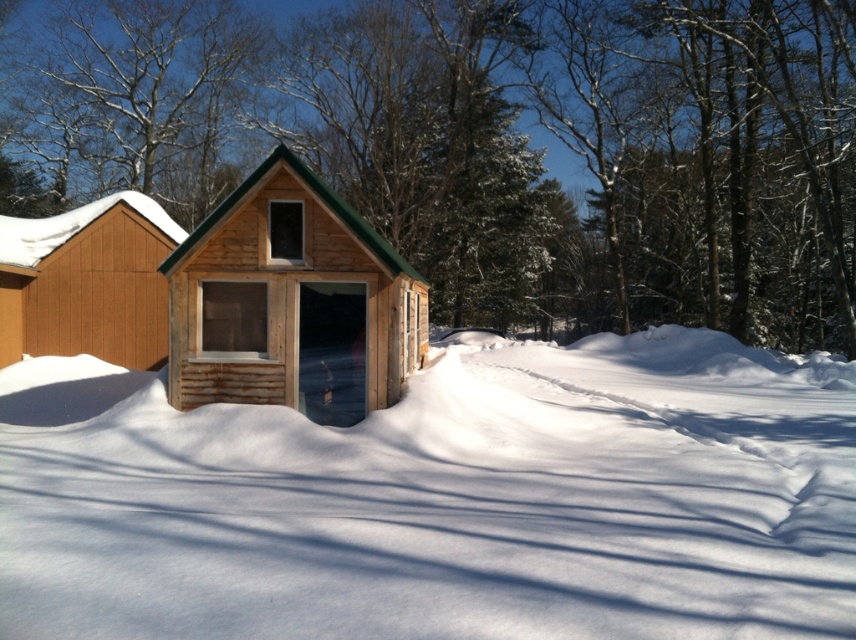
This screenshot has height=640, width=856. What do you see at coordinates (290, 300) in the screenshot?
I see `natural wood cabin at center` at bounding box center [290, 300].

Who is more distant from viewer, (394, 314) or (6, 225)?

The point (6, 225) is more distant.

Who is more distant from viewer, (343, 316) or (28, 252)?

The point (28, 252) is more distant.

Find the location of a particular element. This screenshot has height=640, width=856. natural wood cabin at center is located at coordinates (290, 300).

Which is above, natural wood cabin at center or bare branches at upper center?

bare branches at upper center

You are a GUI agent. You are given a task and a screenshot of the screen. Output one action in this format:
    pyautogui.click(x=<x>, y=<y>)
    Task: Click on the natural wood cabin at center
    
    Given the screenshot: What is the action you would take?
    [290, 300]

Does point (385, 388) lie in front of point (253, 48)?

Yes.

Identify the location of natural wood cabin at center. (290, 300).

Describe the element at coordinates (441, 500) in the screenshot. The image size is (856, 640). I see `white fluffy snow at center` at that location.

Which of these two, white fluffy snow at center or brown wood cabin at left, stands taller?

Standing taller between the two is brown wood cabin at left.

Does point (70, 556) come in front of point (159, 208)?

Yes, it is in front of point (159, 208).

Where is `white fluffy snow at center`? The image size is (856, 640). white fluffy snow at center is located at coordinates (441, 500).